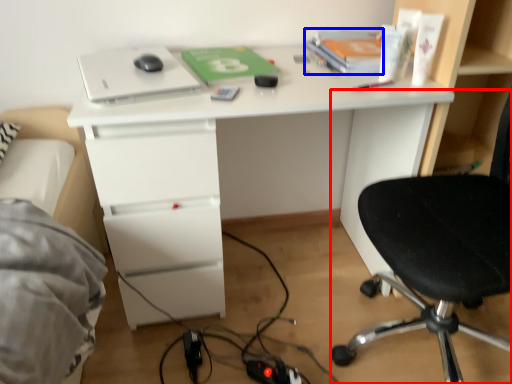
Question: Which object appears closest to the camera in this image, chair (highlighted by a red box) or book (highlighted by a blue box)?

Choices:
 (A) chair
 (B) book

Answer: (A)